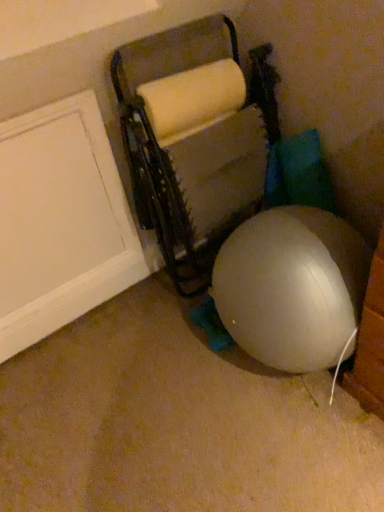
Question: Is point 233,98 positioned closer to the camera than point 66,181?

Choices:
 (A) closer
 (B) farther

Answer: (B)

Question: Is matte gray bean bag chair at center bigger or smaller than white matte door at left?

Choices:
 (A) big
 (B) small

Answer: (A)

Question: From their relative heights in the image, would you say matte gray bean bag chair at center is taller or shorter than white matte door at left?

Choices:
 (A) short
 (B) tall

Answer: (B)

Question: From a real-world perspective, is white matte door at left physically located above or below matte gray bean bag chair at center?

Choices:
 (A) below
 (B) above

Answer: (B)

Question: Is white matte door at left spatially inside matte gray bean bag chair at center, or outside of it?

Choices:
 (A) outside
 (B) inside

Answer: (A)

Question: In terms of size, does white matte door at left appear bigger or smaller than matte gray bean bag chair at center?

Choices:
 (A) big
 (B) small

Answer: (B)

Question: In the image, is white matte door at left positioned in front of or behind matte gray bean bag chair at center?

Choices:
 (A) behind
 (B) front

Answer: (A)